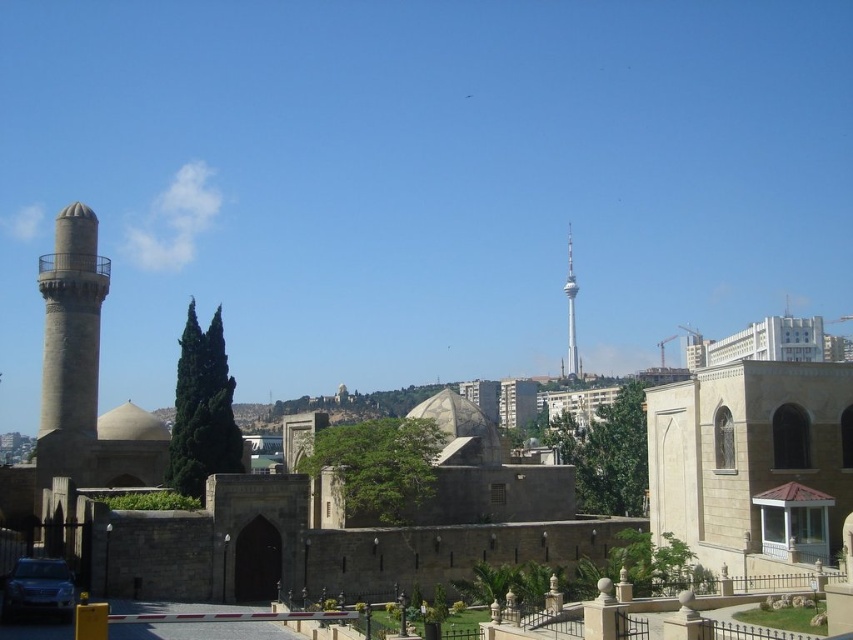
Can you confirm if gray stone minaret at left is smaller than smooth silver tower at upper center?

Yes.

Is gray stone minaret at left closer to camera compared to smooth silver tower at upper center?

Yes.

Describe the element at coordinates (71, 323) in the screenshot. I see `gray stone minaret at left` at that location.

Locate an element on the screen. This screenshot has width=853, height=640. gray stone minaret at left is located at coordinates (71, 323).

Looking at this image, between gray stone minaret at left and silver metallic car at lower left, which one is positioned lower?

Positioned lower is silver metallic car at lower left.

Can you confirm if gray stone minaret at left is thinner than silver metallic car at lower left?

Yes.

Does point (49, 410) lie in front of point (19, 568)?

No.

The height and width of the screenshot is (640, 853). I want to click on gray stone minaret at left, so click(x=71, y=323).

Who is more distant from viewer, (9, 580) or (567, 358)?

Positioned behind is point (567, 358).

The image size is (853, 640). Find the location of `silver metallic car at lower left`. silver metallic car at lower left is located at coordinates (38, 588).

Identify the location of silver metallic car at lower left. (38, 588).